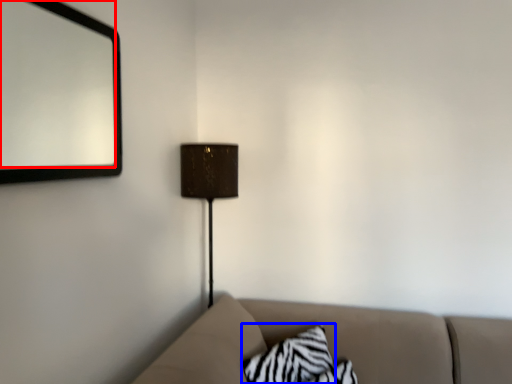
Question: Which of the following is the closest to the observer, mirror (highlighted by a red box) or pillow (highlighted by a blue box)?

Choices:
 (A) mirror
 (B) pillow

Answer: (A)